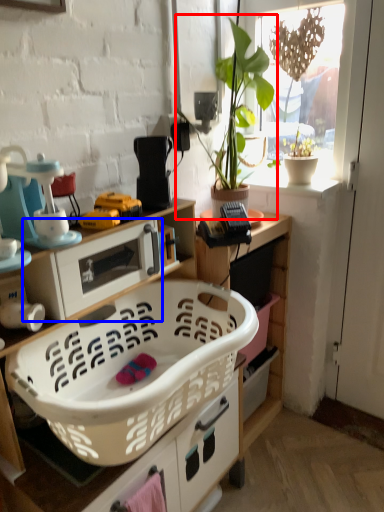
Question: Which of the following is the closest to the observer, houseplant (highlighted by a red box) or appliance (highlighted by a blue box)?

Choices:
 (A) houseplant
 (B) appliance

Answer: (B)